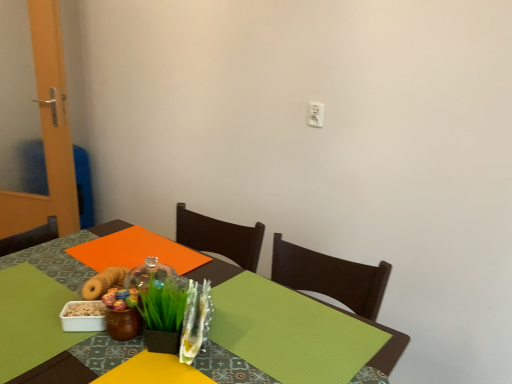
Find the location of a particular element. This screenshot has width=512, height=384. blank space situated above green fabric table at center (from a real-world perspective) is located at coordinates (141, 337).